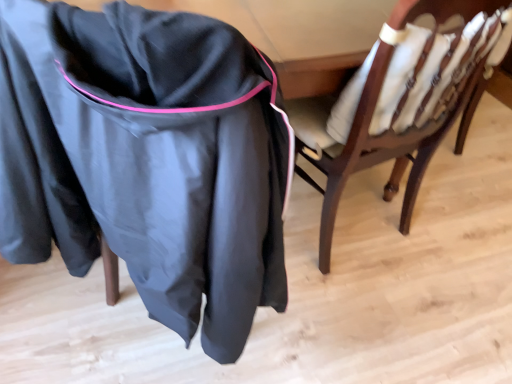
Question: In terms of width, does matte black jacket at left look wider or thinner when compared to wooden chair with white cushions at center?

Choices:
 (A) thin
 (B) wide

Answer: (B)

Question: Considering the positions of matte black jacket at left and wooden chair with white cushions at center in the image, is matte black jacket at left taller or shorter than wooden chair with white cushions at center?

Choices:
 (A) short
 (B) tall

Answer: (B)

Question: Choose the correct answer: Is matte black jacket at left inside wooden chair with white cushions at center or outside it?

Choices:
 (A) outside
 (B) inside

Answer: (A)

Question: Visually, is wooden chair with white cushions at center positioned to the left or to the right of matte black jacket at left?

Choices:
 (A) right
 (B) left

Answer: (A)

Question: From a real-world perspective, is wooden chair with white cushions at center physically located above or below matte black jacket at left?

Choices:
 (A) below
 (B) above

Answer: (A)

Question: Is wooden chair with white cushions at center bigger or smaller than matte black jacket at left?

Choices:
 (A) big
 (B) small

Answer: (B)

Question: Is point (330, 96) closer or farther from the camera than point (78, 254)?

Choices:
 (A) farther
 (B) closer

Answer: (A)